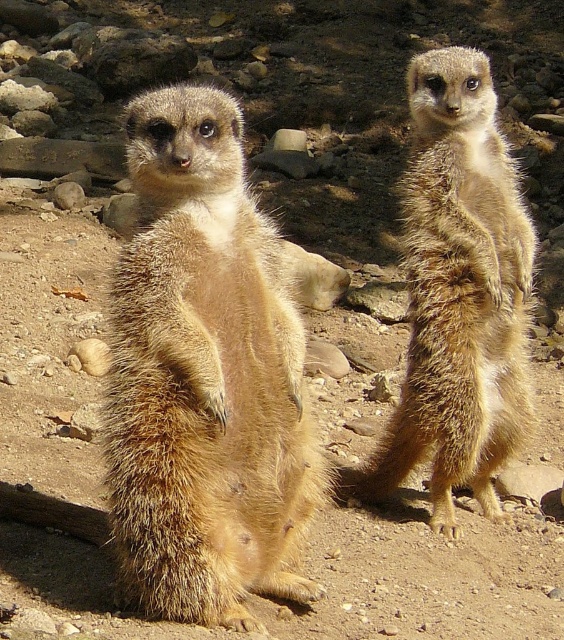
Which of these two, fuzzy golden meerkat at center or golden fur meerkat at upper right, stands taller?

golden fur meerkat at upper right

Who is more forward, (199, 240) or (425, 225)?

Point (199, 240) is in front.

Find the location of a particular element. The height and width of the screenshot is (640, 564). fuzzy golden meerkat at center is located at coordinates (204, 378).